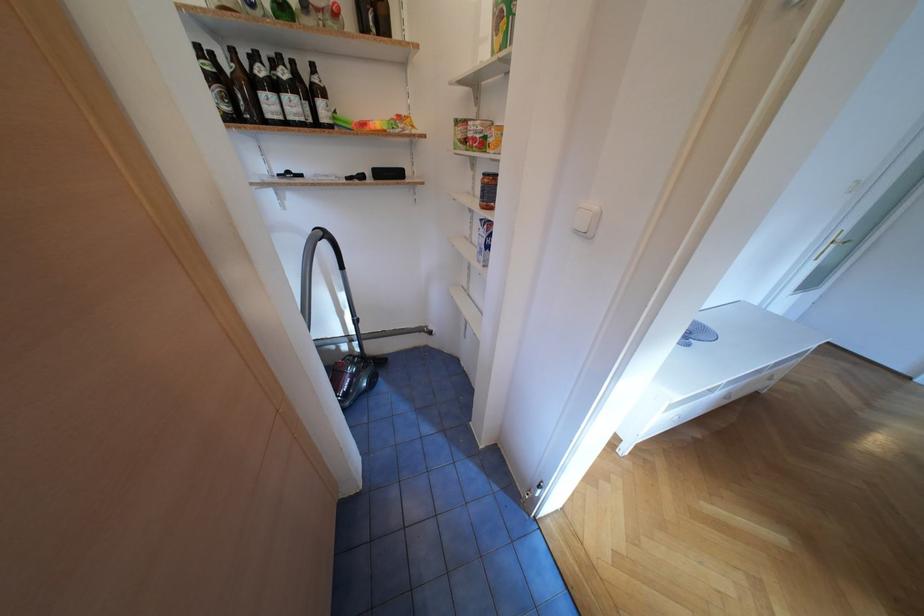
The location [488,190] corresponds to which object?

It corresponds to the glass food jar in the image.